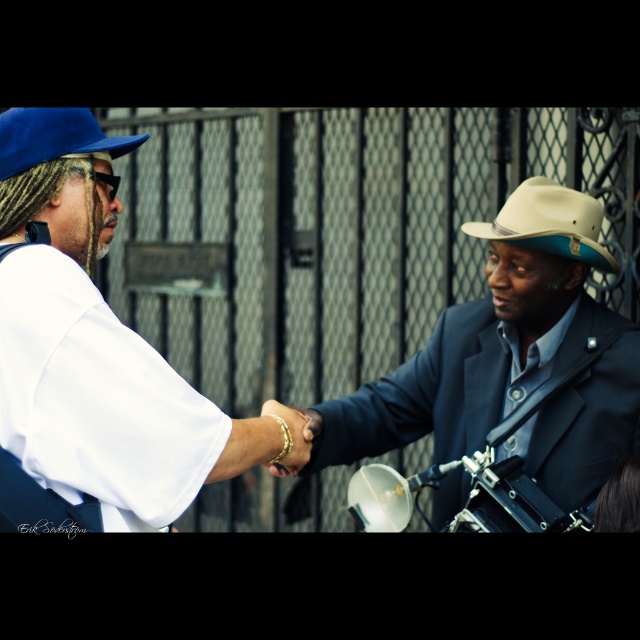
You are a fashion designer observing two items in the scene. You need to decide which item is larger in size between the white matte shirt at left and the blue fabric fedora at left. Based on the scene, which one is bigger?

The white matte shirt at left is bigger than the blue fabric fedora at left according to the description.

You are an artist trying to sketch the scene. The white matte shirt at left is positioned at a specific coordinate. Can you determine its exact location in terms of coordinates?

The white matte shirt at left is located at the 2D coordinate point of (92, 352).